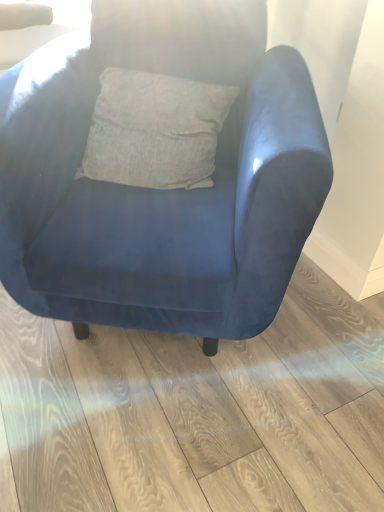
Question: Based on their positions, is velvet blue armchair at center located to the left or right of blue velvet armchair at center?

Choices:
 (A) left
 (B) right

Answer: (A)

Question: From their relative heights in the image, would you say velvet blue armchair at center is taller or shorter than blue velvet armchair at center?

Choices:
 (A) short
 (B) tall

Answer: (B)

Question: Considering the positions of point (157, 203) and point (329, 347), is point (157, 203) closer or farther from the camera than point (329, 347)?

Choices:
 (A) farther
 (B) closer

Answer: (B)

Question: Would you say blue velvet armchair at center is to the left or to the right of velvet blue armchair at center in the picture?

Choices:
 (A) right
 (B) left

Answer: (A)

Question: Considering the positions of blue velvet armchair at center and velvet blue armchair at center in the image, is blue velvet armchair at center wider or thinner than velvet blue armchair at center?

Choices:
 (A) wide
 (B) thin

Answer: (A)

Question: Considering their positions, is blue velvet armchair at center located in front of or behind velvet blue armchair at center?

Choices:
 (A) front
 (B) behind

Answer: (B)

Question: Is blue velvet armchair at center spatially inside velvet blue armchair at center, or outside of it?

Choices:
 (A) inside
 (B) outside

Answer: (B)